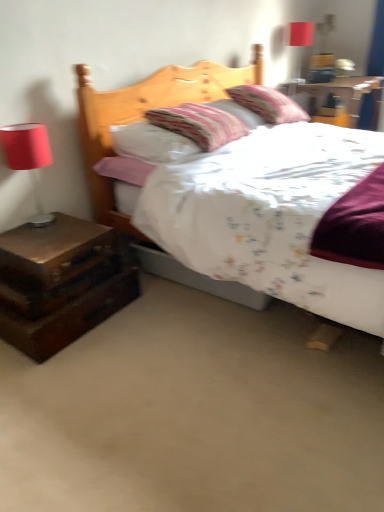
Question: From the image's perspective, does matte red lampshade at upper right appear higher than fluffy cotton pillow at upper center, the 2th pillow in the front-to-back sequence?

Choices:
 (A) yes
 (B) no

Answer: (A)

Question: From a real-world perspective, is matte red lampshade at upper right below fluffy cotton pillow at upper center, the 2th pillow in the front-to-back sequence?

Choices:
 (A) no
 (B) yes

Answer: (A)

Question: Is matte red lampshade at upper right thinner than fluffy cotton pillow at upper center, the 2th pillow in the front-to-back sequence?

Choices:
 (A) yes
 (B) no

Answer: (A)

Question: Would you say matte red lampshade at upper right contains fluffy cotton pillow at upper center, which is counted as the 1th pillow, starting from the back?

Choices:
 (A) no
 (B) yes

Answer: (A)

Question: Is matte red lampshade at upper right smaller than fluffy cotton pillow at upper center, which is counted as the 1th pillow, starting from the back?

Choices:
 (A) yes
 (B) no

Answer: (A)

Question: Considering the relative sizes of matte red lampshade at upper right and fluffy cotton pillow at upper center, the 2th pillow in the front-to-back sequence, in the image provided, is matte red lampshade at upper right taller than fluffy cotton pillow at upper center, the 2th pillow in the front-to-back sequence,?

Choices:
 (A) no
 (B) yes

Answer: (B)

Question: Is wooden drawer at left far from striped fabric pillow at center, acting as the 1th pillow starting from the front?

Choices:
 (A) yes
 (B) no

Answer: (B)

Question: Can you confirm if wooden drawer at left is thinner than striped fabric pillow at center, acting as the 1th pillow starting from the front?

Choices:
 (A) no
 (B) yes

Answer: (B)

Question: Is striped fabric pillow at center, acting as the 1th pillow starting from the front, located within wooden drawer at left?

Choices:
 (A) yes
 (B) no

Answer: (B)

Question: Can you confirm if wooden drawer at left is bigger than striped fabric pillow at center, acting as the 1th pillow starting from the front?

Choices:
 (A) yes
 (B) no

Answer: (B)

Question: Can you confirm if wooden drawer at left is smaller than striped fabric pillow at center, acting as the 1th pillow starting from the front?

Choices:
 (A) no
 (B) yes

Answer: (B)

Question: From a real-world perspective, is wooden drawer at left physically below striped fabric pillow at center, acting as the 1th pillow starting from the front?

Choices:
 (A) yes
 (B) no

Answer: (A)

Question: From the image's perspective, would you say wooden nightstand at upper right, marked as the 3th nightstand in a left-to-right arrangement, is shown under matte red lampshade at left?

Choices:
 (A) no
 (B) yes

Answer: (A)